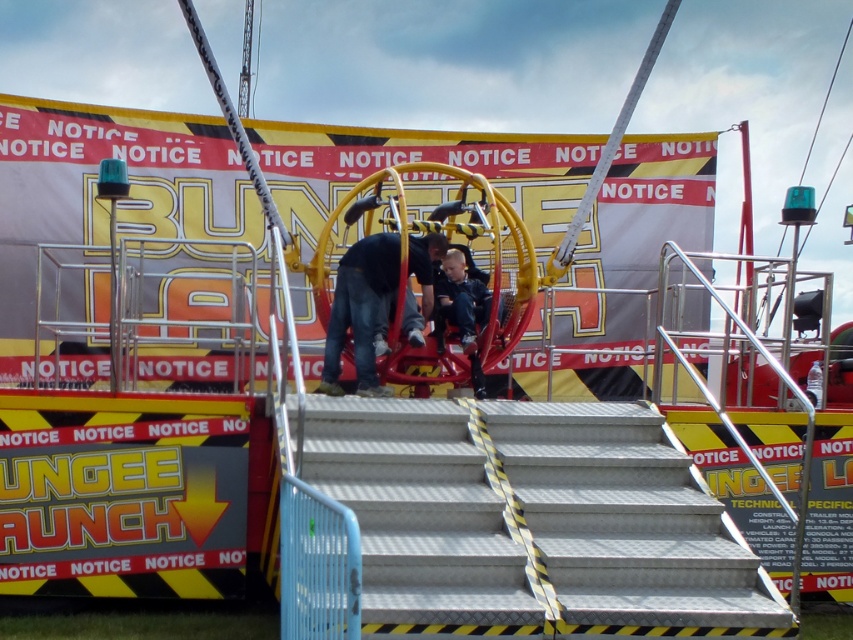
Can you confirm if metallic/stainless steel stairs at center is positioned to the left of dark blue jeans at center?

No, metallic/stainless steel stairs at center is not to the left of dark blue jeans at center.

Can you confirm if metallic/stainless steel stairs at center is wider than dark blue jeans at center?

In fact, metallic/stainless steel stairs at center might be narrower than dark blue jeans at center.

This screenshot has width=853, height=640. I want to click on metallic/stainless steel stairs at center, so click(532, 522).

Who is lower down, metallic/stainless steel stairs at center or denim jeans at center?

metallic/stainless steel stairs at center

Does metallic/stainless steel stairs at center have a greater height compared to denim jeans at center?

Incorrect, metallic/stainless steel stairs at center's height is not larger of denim jeans at center's.

What do you see at coordinates (532, 522) in the screenshot?
I see `metallic/stainless steel stairs at center` at bounding box center [532, 522].

Locate an element on the screen. The height and width of the screenshot is (640, 853). metallic/stainless steel stairs at center is located at coordinates (532, 522).

Measure the distance between denim jeans at center and dark blue jeans at center.

denim jeans at center and dark blue jeans at center are 6.78 feet apart.

Between denim jeans at center and dark blue jeans at center, which one has less height?

dark blue jeans at center

Does point (428, 291) come behind point (451, 276)?

No, it is not.

Locate an element on the screen. This screenshot has height=640, width=853. denim jeans at center is located at coordinates (360, 308).